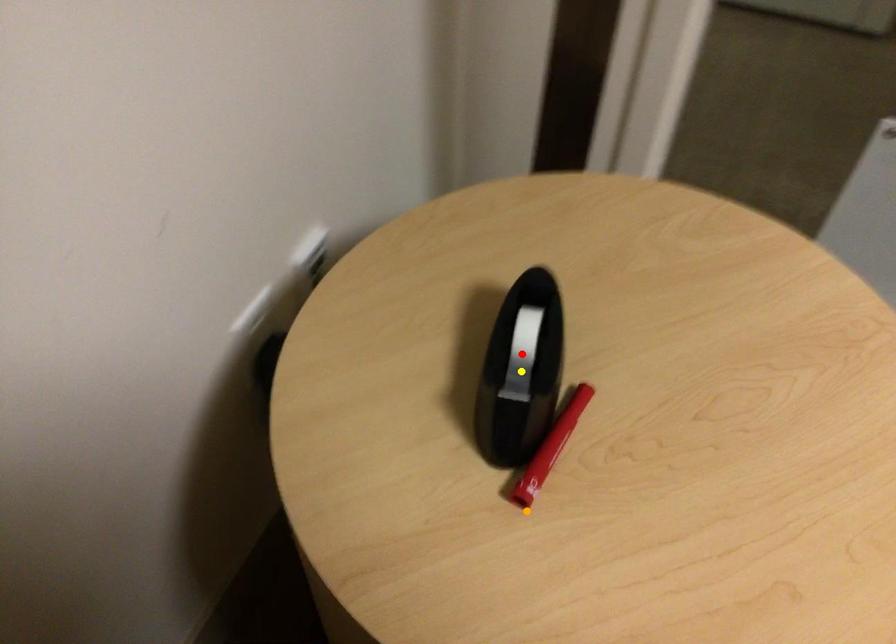
In the scene shown: Order these from nearest to farthest:
yellow point, red point, orange point

orange point, yellow point, red point